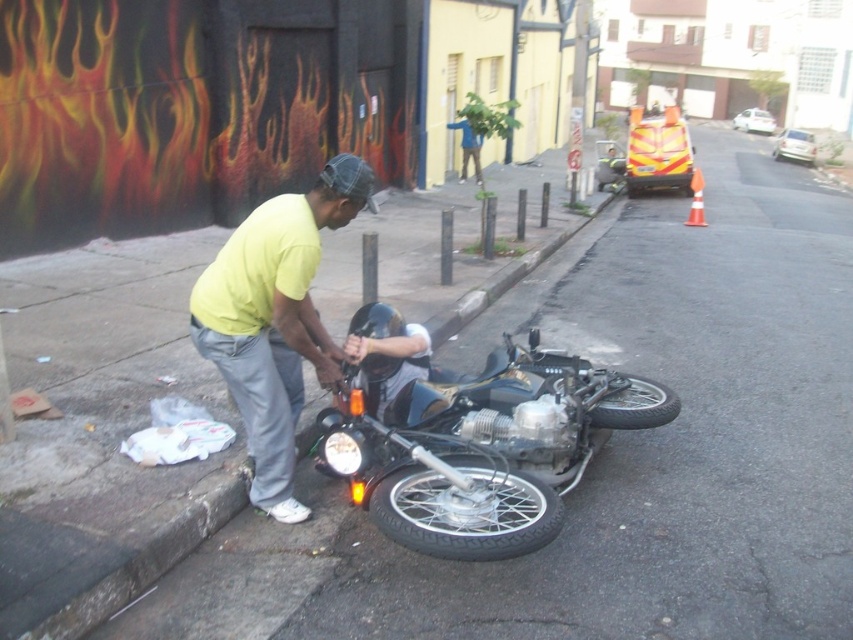
Question: Which point is closer to the camera?

Choices:
 (A) (128, 560)
 (B) (241, 360)

Answer: (A)

Question: Estimate the real-world distances between objects in this image. Which object is closer to the black rubber tire at lower center?

Choices:
 (A) black rubber tire at lower right
 (B) concrete at lower left

Answer: (B)

Question: Is shiny chrome motorcycle at center to the left of concrete at lower left from the viewer's perspective?

Choices:
 (A) no
 (B) yes

Answer: (B)

Question: Is shiny chrome motorcycle at center bigger than yellow matte shirt at center?

Choices:
 (A) yes
 (B) no

Answer: (A)

Question: Is yellow matte shirt at center wider than black rubber tire at lower center?

Choices:
 (A) yes
 (B) no

Answer: (A)

Question: Among these objects, which one is nearest to the camera?

Choices:
 (A) black rubber tire at lower right
 (B) black rubber tire at lower center

Answer: (B)